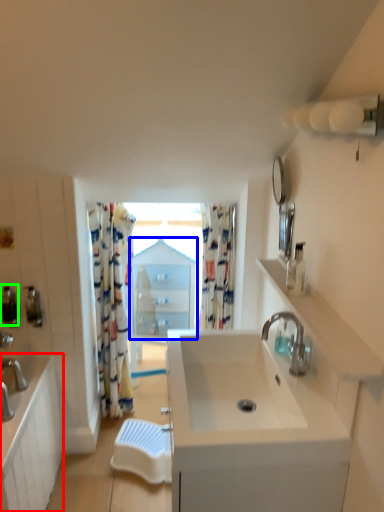
Question: Based on their relative distances, which object is nearer to bathroom cabinet (highlighted by a red box)? Choose from medicine cabinet (highlighted by a blue box) and soap dispenser (highlighted by a green box).

Choices:
 (A) medicine cabinet
 (B) soap dispenser

Answer: (B)